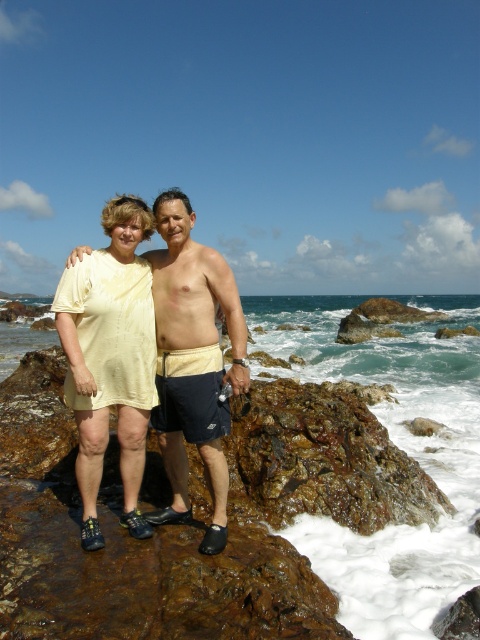
Is point (475, 570) less distant than point (144, 458)?

No.

Is point (391, 406) less distant than point (68, 317)?

No, (391, 406) is further to viewer.

This screenshot has height=640, width=480. In order to click on clear blue water at center in this screenshot , I will do `click(400, 448)`.

Can you confirm if matte yellow dress at center is positioned to the right of beige cotton shirt at center?

Incorrect, matte yellow dress at center is not on the right side of beige cotton shirt at center.

Who is more forward, (145, 356) or (213, 273)?

Positioned in front is point (145, 356).

This screenshot has width=480, height=640. I want to click on matte yellow dress at center, so click(109, 358).

Can you confirm if clear blue water at center is positioned to the right of beige cotton shirt at center?

Correct, you'll find clear blue water at center to the right of beige cotton shirt at center.

Describe the element at coordinates (400, 448) in the screenshot. This screenshot has height=640, width=480. I see `clear blue water at center` at that location.

The height and width of the screenshot is (640, 480). What are the coordinates of `clear blue water at center` in the screenshot? It's located at (400, 448).